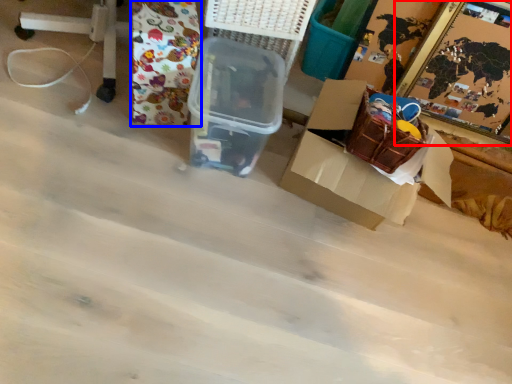
Question: Which object appears farthest to the camera in this image, picture frame (highlighted by a red box) or wrapping paper (highlighted by a blue box)?

Choices:
 (A) picture frame
 (B) wrapping paper

Answer: (A)